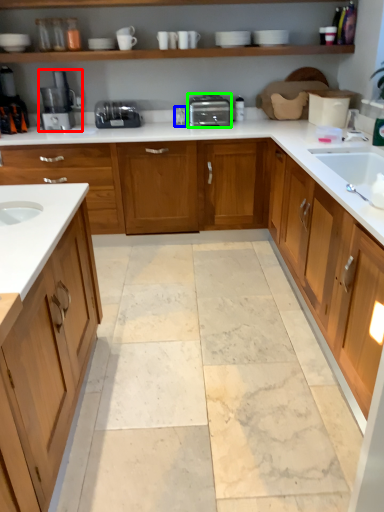
Question: Which object is positioned closest to home appliance (highlighted by a red box)? Select from faucet (highlighted by a blue box) and toaster (highlighted by a green box).

Choices:
 (A) faucet
 (B) toaster

Answer: (A)